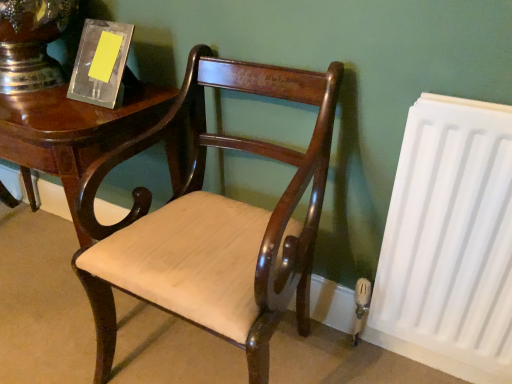
Question: Is mahogany wood chair at center located outside white matte radiator at right?

Choices:
 (A) yes
 (B) no

Answer: (A)

Question: Can white matte radiator at right be found inside mahogany wood chair at center?

Choices:
 (A) no
 (B) yes

Answer: (A)

Question: Are mahogany wood chair at center and white matte radiator at right beside each other?

Choices:
 (A) yes
 (B) no

Answer: (B)

Question: From a real-world perspective, does mahogany wood chair at center stand above white matte radiator at right?

Choices:
 (A) yes
 (B) no

Answer: (A)

Question: Can you confirm if mahogany wood chair at center is positioned to the right of white matte radiator at right?

Choices:
 (A) no
 (B) yes

Answer: (A)

Question: Does mahogany wood chair at center have a lesser height compared to white matte radiator at right?

Choices:
 (A) no
 (B) yes

Answer: (A)

Question: Does white matte radiator at right appear on the right side of mahogany wood chair at center?

Choices:
 (A) no
 (B) yes

Answer: (B)

Question: Considering the relative sizes of white matte radiator at right and mahogany wood chair at center in the image provided, is white matte radiator at right wider than mahogany wood chair at center?

Choices:
 (A) no
 (B) yes

Answer: (A)

Question: Is white matte radiator at right thinner than mahogany wood chair at center?

Choices:
 (A) no
 (B) yes

Answer: (B)

Question: Considering the relative sizes of white matte radiator at right and mahogany wood chair at center in the image provided, is white matte radiator at right bigger than mahogany wood chair at center?

Choices:
 (A) yes
 (B) no

Answer: (B)

Question: Is white matte radiator at right oriented towards mahogany wood chair at center?

Choices:
 (A) yes
 (B) no

Answer: (B)

Question: From a real-world perspective, is white matte radiator at right physically below mahogany wood chair at center?

Choices:
 (A) yes
 (B) no

Answer: (A)

Question: Does shiny dark wood table at left come in front of white matte radiator at right?

Choices:
 (A) yes
 (B) no

Answer: (B)